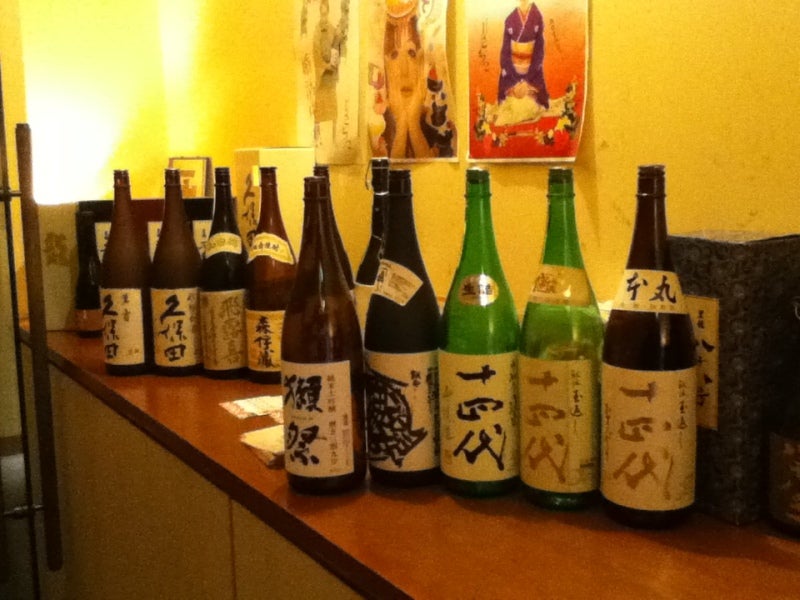
Image resolution: width=800 pixels, height=600 pixels. Find the location of `lower cabinets`. lower cabinets is located at coordinates (110, 490), (286, 563).